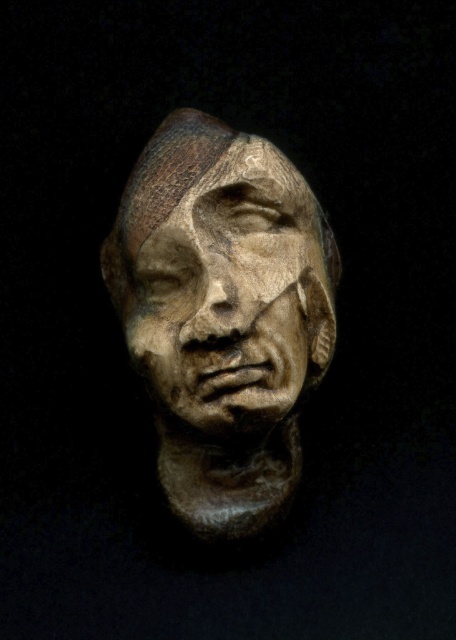
Question: Which of the following is the farthest from the observer?

Choices:
 (A) wooden sculpture at center
 (B) matte bronze sculpture at center

Answer: (B)

Question: Which object appears farthest from the camera in this image?

Choices:
 (A) matte bronze sculpture at center
 (B) wooden sculpture at center

Answer: (A)

Question: Is wooden sculpture at center positioned before matte bronze sculpture at center?

Choices:
 (A) no
 (B) yes

Answer: (B)

Question: Observing the image, what is the correct spatial positioning of wooden sculpture at center in reference to matte bronze sculpture at center?

Choices:
 (A) right
 (B) left

Answer: (B)

Question: Can you confirm if wooden sculpture at center is positioned to the right of matte bronze sculpture at center?

Choices:
 (A) no
 (B) yes

Answer: (A)